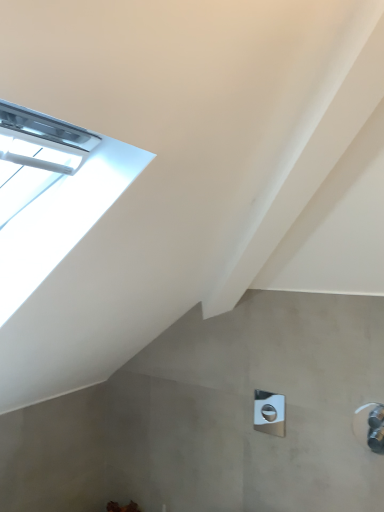
Where is `white glossy window at upper left`? This screenshot has width=384, height=512. white glossy window at upper left is located at coordinates (52, 194).

What do you see at coordinates (52, 194) in the screenshot?
I see `white glossy window at upper left` at bounding box center [52, 194].

At what (x,y) coordinates should I click in order to perform the action: click on white glossy window at upper left. Please return your answer as a coordinate pair (x, y). This screenshot has width=384, height=512. Looking at the image, I should click on (52, 194).